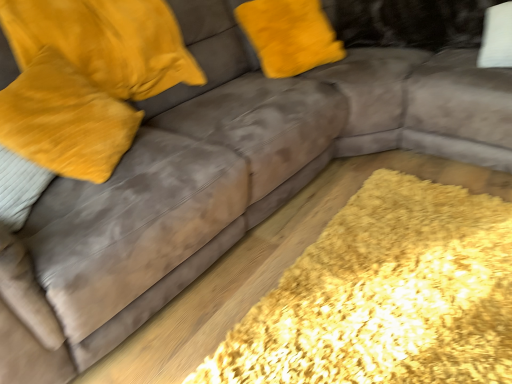
Question: From the image's perspective, is velvet yellow pillow at upper left, the second pillow viewed from the left, above or below yellow shaggy rug at lower right?

Choices:
 (A) below
 (B) above

Answer: (B)

Question: Does point (46, 13) appear closer or farther from the camera than point (498, 367)?

Choices:
 (A) farther
 (B) closer

Answer: (A)

Question: Which object is the closest to the velvet yellow pillow at upper left, the second pillow viewed from the left?

Choices:
 (A) velvet yellow pillow at left, which is counted as the first pillow, starting from the left
 (B) yellow shaggy rug at lower right

Answer: (A)

Question: Based on their relative distances, which object is nearer to the yellow shaggy rug at lower right?

Choices:
 (A) velvet yellow pillow at left, acting as the 2th pillow starting from the right
 (B) velvet yellow pillow at upper left, the second pillow viewed from the left

Answer: (A)